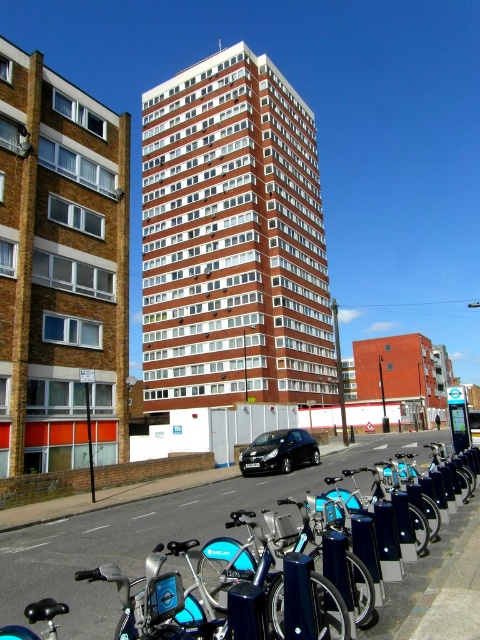
You are a delivery person trying to park your 1.8 meters wide delivery cart between the metallic gray bike rack at lower center and the black metallic car at center. Can your cart fit in the space between them?

The metallic gray bike rack at lower center is wider than the black metallic car at center. Since the bike rack is wider, the space between them might be sufficient for your 1.8 meters wide delivery cart. However, without knowing the exact distance between the two objects, it is difficult to confirm. Please check the actual space before attempting to park.

You are a delivery person who needs to park your 7.5 feet long delivery van between the metallic gray bike rack at lower center and the black metallic car at center. Can you fit your van in the space between them?

The metallic gray bike rack at lower center is 9.50 feet away from the black metallic car at center. Since the van is 7.5 feet long, it can fit in the space between them as there is enough distance.

You are a delivery person trying to park your 2.5 meter long van. You see the metallic gray bike rack at lower center and the black metallic car at center. Can you fit your van between them?

The metallic gray bike rack at lower center is larger than the black metallic car at center. However, the exact distance between them is not specified. Without knowing the space between the bike rack and the car, it is impossible to determine if the van will fit.